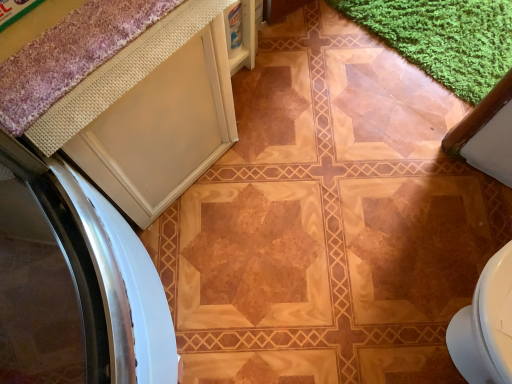
Question: Does point (132, 8) appear closer or farther from the camera than point (130, 206)?

Choices:
 (A) closer
 (B) farther

Answer: (A)

Question: Is purple textured bath mat at upper left situated inside white matte cabinet at upper left or outside?

Choices:
 (A) outside
 (B) inside

Answer: (A)

Question: Would you say purple textured bath mat at upper left is to the left or to the right of white matte cabinet at upper left in the picture?

Choices:
 (A) right
 (B) left

Answer: (A)

Question: Is point (222, 117) positioned closer to the camera than point (18, 64)?

Choices:
 (A) farther
 (B) closer

Answer: (A)

Question: In the image, is white matte cabinet at upper left positioned in front of or behind purple textured bath mat at upper left?

Choices:
 (A) front
 (B) behind

Answer: (B)

Question: In terms of height, does white matte cabinet at upper left look taller or shorter compared to purple textured bath mat at upper left?

Choices:
 (A) tall
 (B) short

Answer: (A)

Question: Considering the positions of white matte cabinet at upper left and purple textured bath mat at upper left in the image, is white matte cabinet at upper left wider or thinner than purple textured bath mat at upper left?

Choices:
 (A) wide
 (B) thin

Answer: (A)